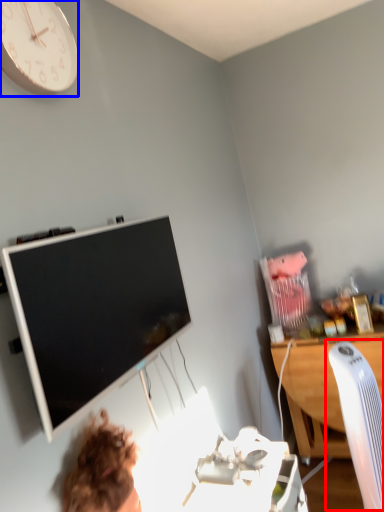
Question: Which object appears closest to the camera in this image, computer chair (highlighted by a red box) or wall clock (highlighted by a blue box)?

Choices:
 (A) computer chair
 (B) wall clock

Answer: (B)